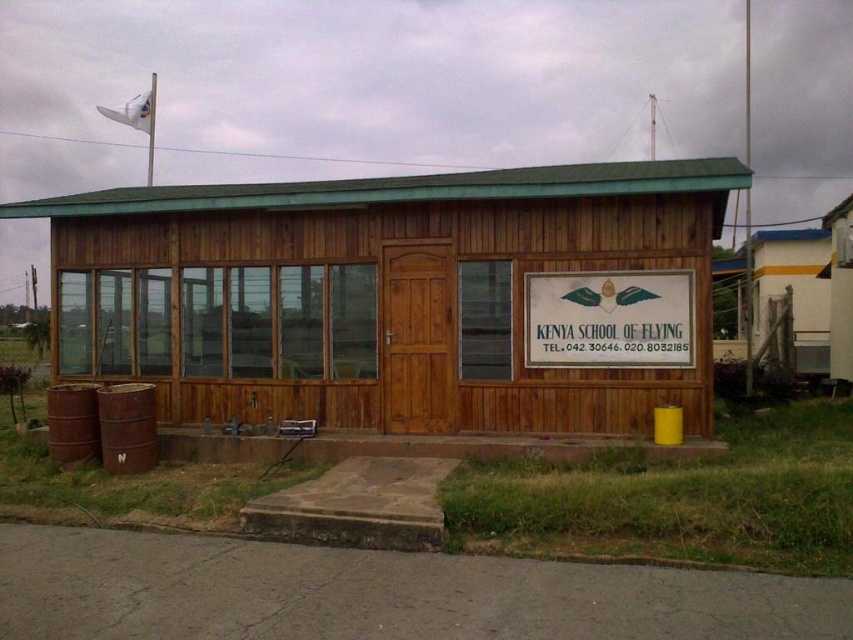
Is point (596, 275) in front of point (688, 312)?

No, (596, 275) is further to viewer.

Can you confirm if wooden hut at center is taller than white wooden sign at center?

Yes.

Describe the element at coordinates (399, 296) in the screenshot. I see `wooden hut at center` at that location.

This screenshot has height=640, width=853. What are the coordinates of `wooden hut at center` in the screenshot? It's located at (399, 296).